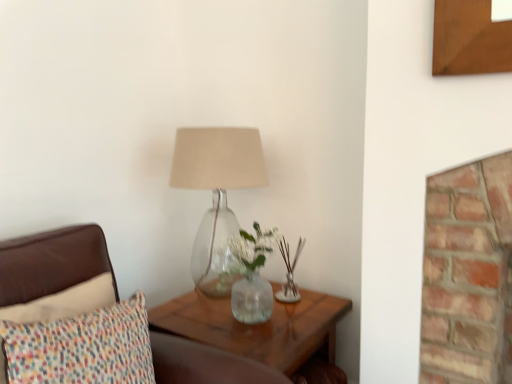
Question: Considering the positions of point (217, 142) and point (335, 299), is point (217, 142) closer or farther from the camera than point (335, 299)?

Choices:
 (A) closer
 (B) farther

Answer: (A)

Question: Looking at their shapes, would you say translucent glass lamp at center is wider or thinner than translucent wood table at lower right?

Choices:
 (A) wide
 (B) thin

Answer: (B)

Question: Estimate the real-world distances between objects in this image. Which object is closer to the translucent wood table at lower right?

Choices:
 (A) translucent glass lamp at center
 (B) multicolored fabric pillow at left

Answer: (A)

Question: Considering the real-world distances, which object is farthest from the translucent glass lamp at center?

Choices:
 (A) translucent wood table at lower right
 (B) multicolored fabric pillow at left

Answer: (B)